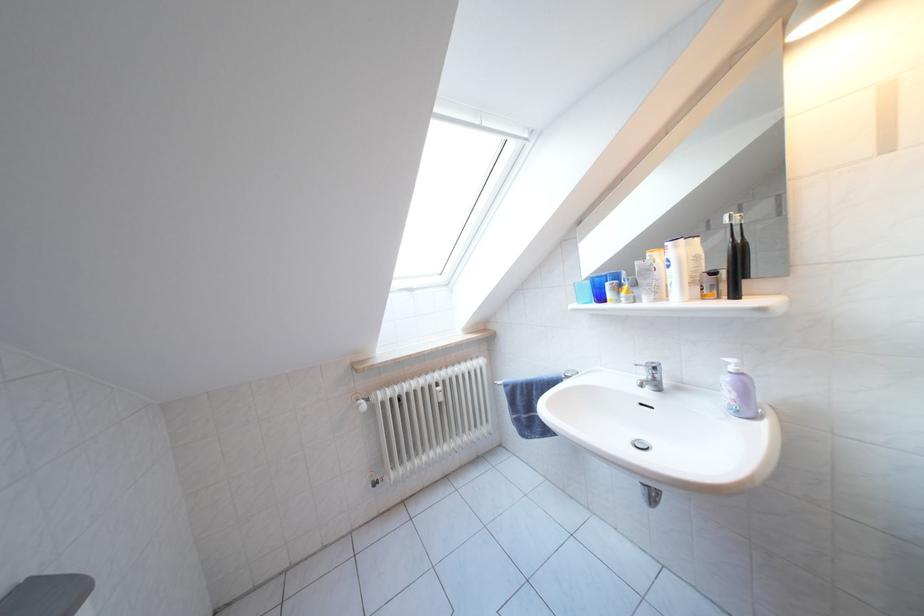
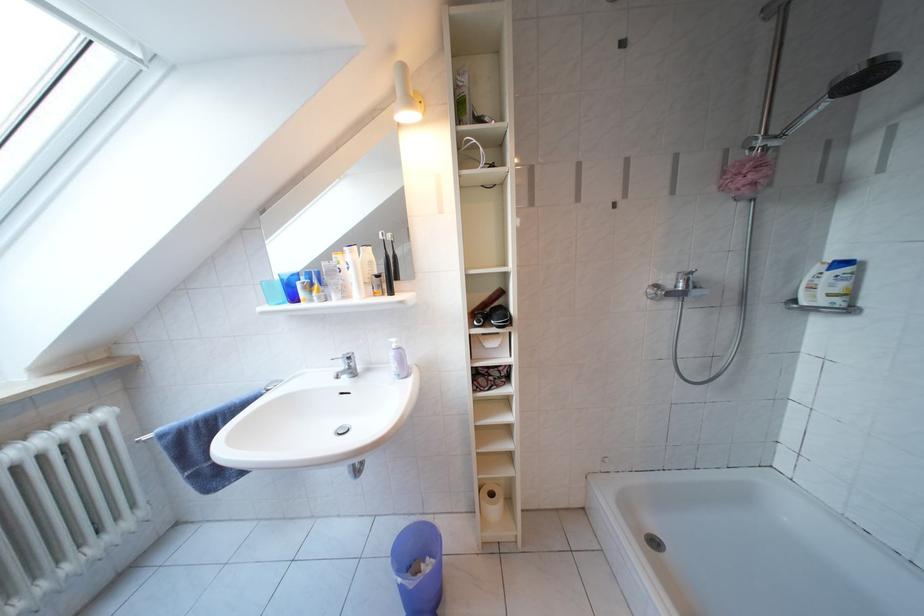
The point at (739,365) is marked in the first image. Where is the corresponding point in the second image?

(402, 345)